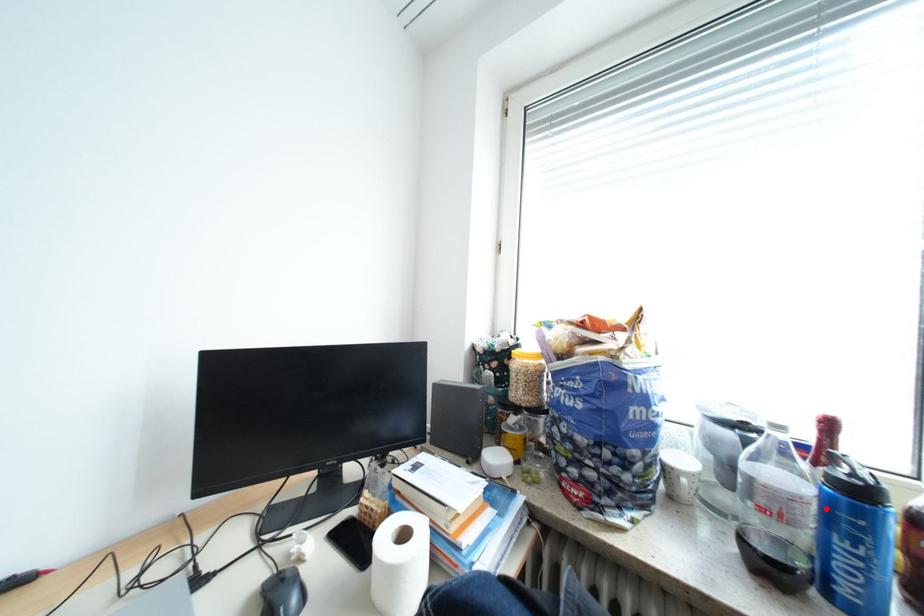
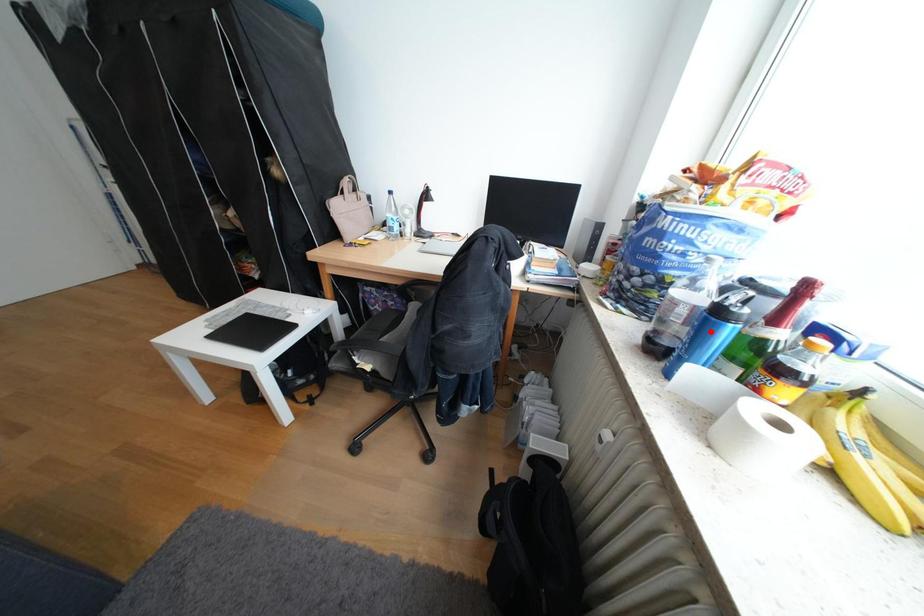
Based on the photo, I am providing you with two images of the same scene from different viewpoints. A red point is marked on the first image and another point is marked on the second image. Is the red point in image1 aligned with the point shown in image2?

No